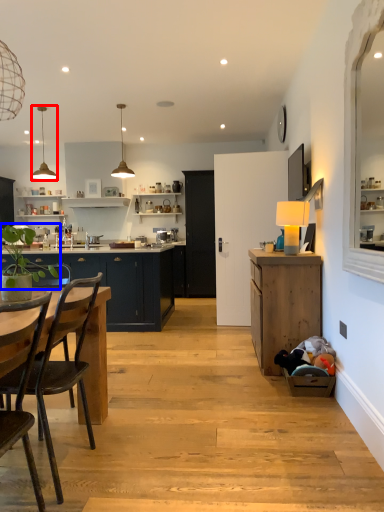
Question: Which object is closer to the camera taking this photo, lamp (highlighted by a red box) or plant (highlighted by a blue box)?

Choices:
 (A) lamp
 (B) plant

Answer: (B)